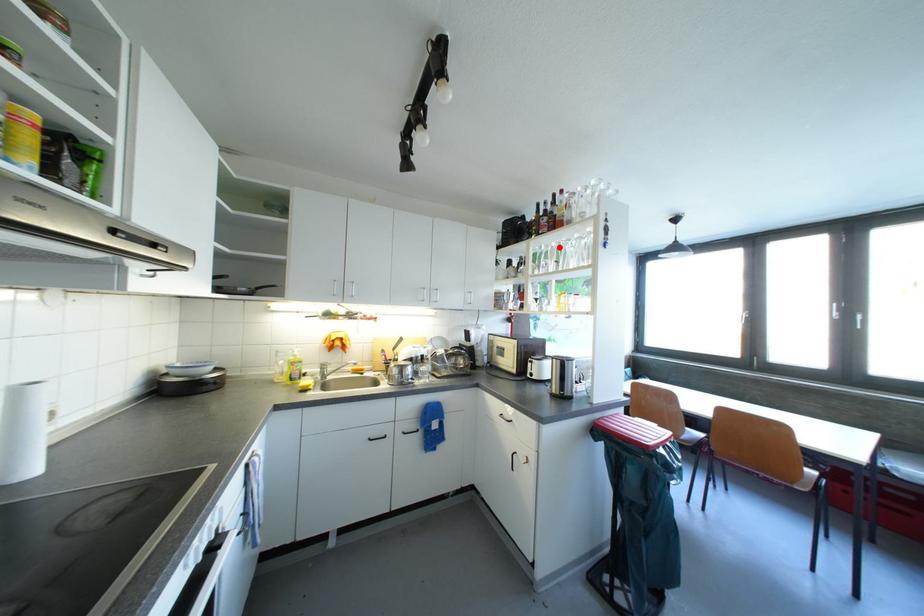
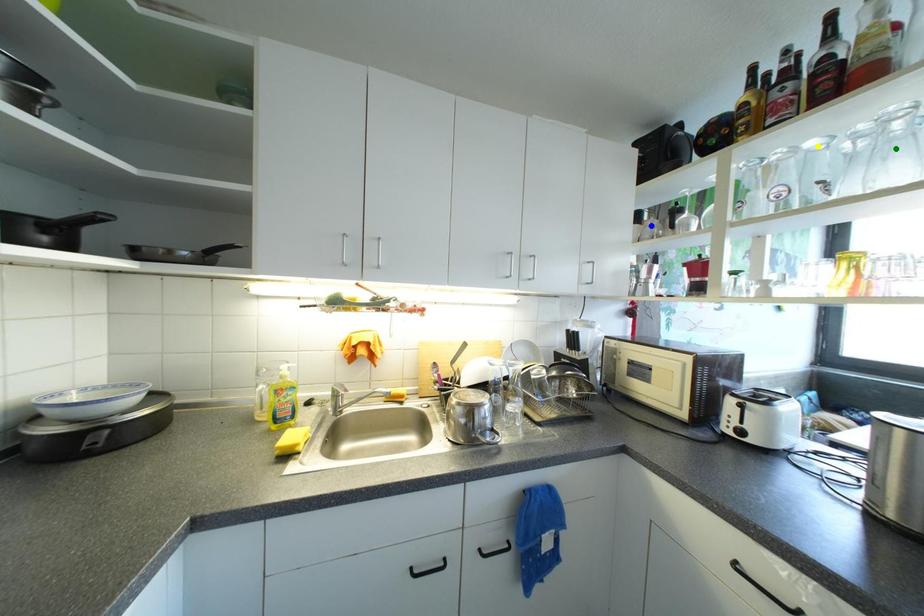
Question: I am providing you with two images of the same scene from different viewpoints. A red point is marked on the first image. You are given multiple points on the second image. Which point in image 2 represents the same 3d spot as the red point in image 1?

Choices:
 (A) green point
 (B) yellow point
 (C) blue point

Answer: (B)